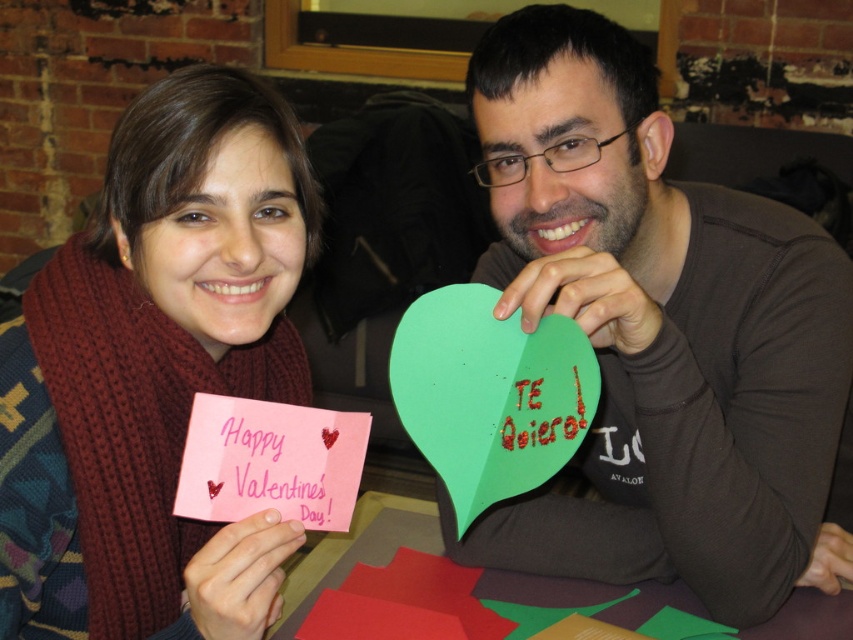
Is green paper heart at center above pink paper card at lower left?

Yes.

Between point (688, 352) and point (201, 486), which one is positioned behind?

The point (688, 352) is behind.

Where is `green paper heart at center`? The height and width of the screenshot is (640, 853). green paper heart at center is located at coordinates (659, 332).

At what (x,y) coordinates should I click in order to perform the action: click on green paper heart at center. Please return your answer as a coordinate pair (x, y). The image size is (853, 640). Looking at the image, I should click on (659, 332).

Who is more distant from viewer, (42, 307) or (279, 420)?

The point (42, 307) is more distant.

Does pink knitted scarf at left lie behind pink paper card at lower left?

No.

I want to click on pink knitted scarf at left, so click(x=155, y=371).

Is pink knitted scarf at left wider than green paper heart at upper center?

Yes, pink knitted scarf at left is wider than green paper heart at upper center.

Measure the distance between point (28, 545) and camera.

They are 25.02 inches apart.

This screenshot has height=640, width=853. Describe the element at coordinates (155, 371) in the screenshot. I see `pink knitted scarf at left` at that location.

Locate an element on the screen. Image resolution: width=853 pixels, height=640 pixels. pink knitted scarf at left is located at coordinates (155, 371).